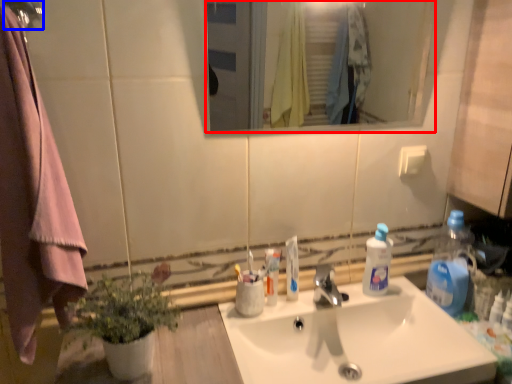
Question: Which of the following is the farthest to the observer, mirror (highlighted by a red box) or shower (highlighted by a blue box)?

Choices:
 (A) mirror
 (B) shower

Answer: (A)